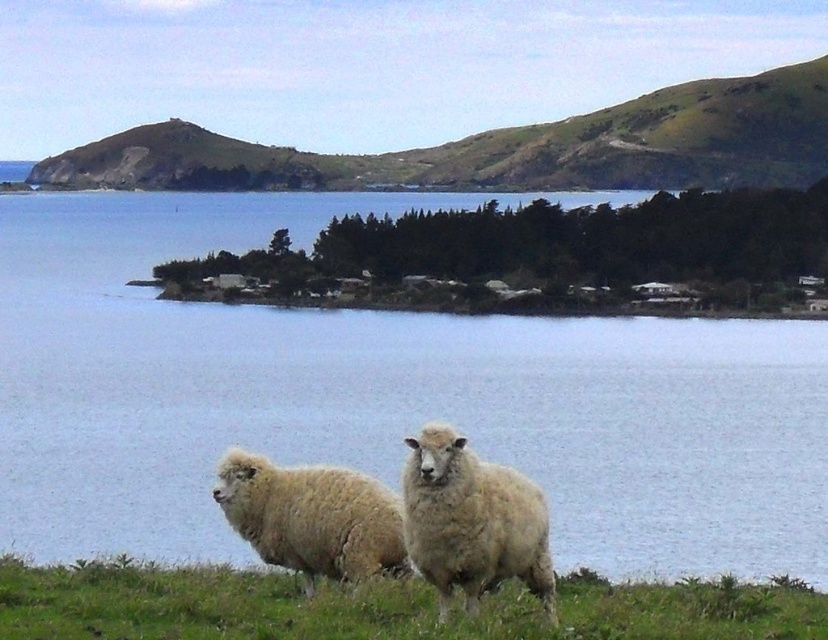
Question: Among these points, which one is farthest from the camera?

Choices:
 (A) (593, 138)
 (B) (367, 540)
 (C) (778, 600)
 (D) (427, 552)

Answer: (A)

Question: Can you confirm if green grassy hillside at upper center is smaller than white woolly sheep at center?

Choices:
 (A) no
 (B) yes

Answer: (A)

Question: Which is nearer to the blue water at center?

Choices:
 (A) fuzzy white sheep at lower center
 (B) white woolly sheep at center
 (C) white fluffy grass at center

Answer: (B)

Question: Is blue water at center in front of white woolly sheep at center?

Choices:
 (A) no
 (B) yes

Answer: (A)

Question: Which object is the closest to the blue water at center?

Choices:
 (A) white woolly sheep at center
 (B) fuzzy white sheep at lower center

Answer: (A)

Question: Does white fluffy grass at center appear on the right side of fuzzy white sheep at lower center?

Choices:
 (A) no
 (B) yes

Answer: (B)